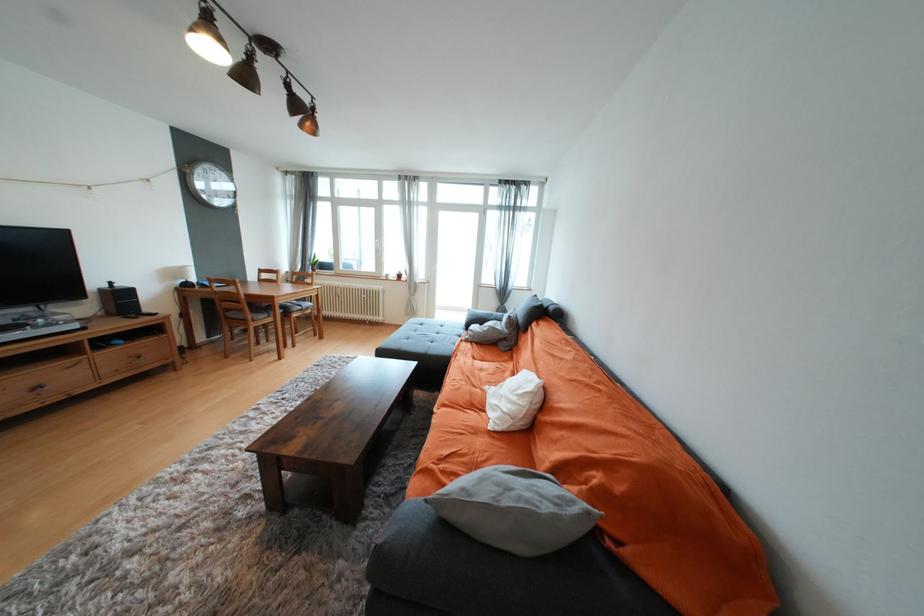
I want to click on radiator valve, so click(x=351, y=301).